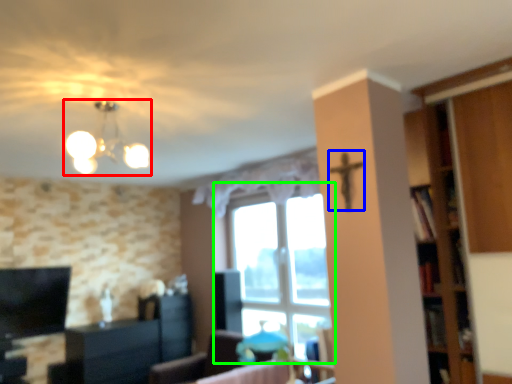
Question: Which object is positioned farthest from lamp (highlighted by a red box)? Select from crucifix (highlighted by a blue box) and window (highlighted by a green box).

Choices:
 (A) crucifix
 (B) window

Answer: (B)